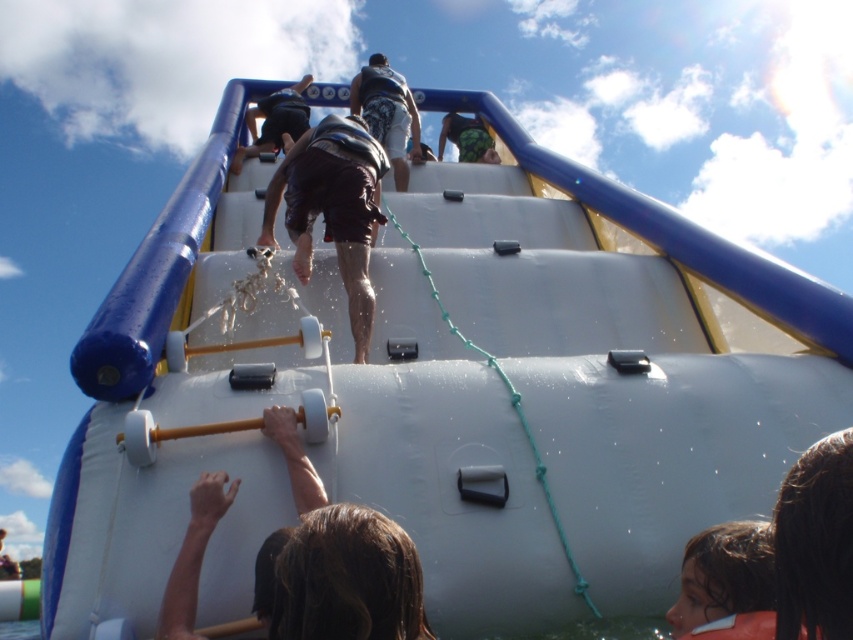
Question: Which object is the farthest from the brown fabric shorts at upper center?

Choices:
 (A) brown textured shorts at center
 (B) dark brown hair at lower right

Answer: (A)

Question: Does brown matte shorts at center have a greater width compared to green textured shorts at upper center?

Choices:
 (A) yes
 (B) no

Answer: (A)

Question: Does brown matte shorts at center appear over dark blue fabric at upper center?

Choices:
 (A) no
 (B) yes

Answer: (A)

Question: Is dark brown hair at lower right to the right of dark blue fabric at upper center from the viewer's perspective?

Choices:
 (A) no
 (B) yes

Answer: (B)

Question: Which object is closer to the camera taking this photo?

Choices:
 (A) brown hair at lower right
 (B) brown matte bar at center
 (C) green textured shorts at upper center

Answer: (A)

Question: Which object is closer to the camera taking this photo?

Choices:
 (A) brown matte bar at center
 (B) brown matte shorts at center

Answer: (A)